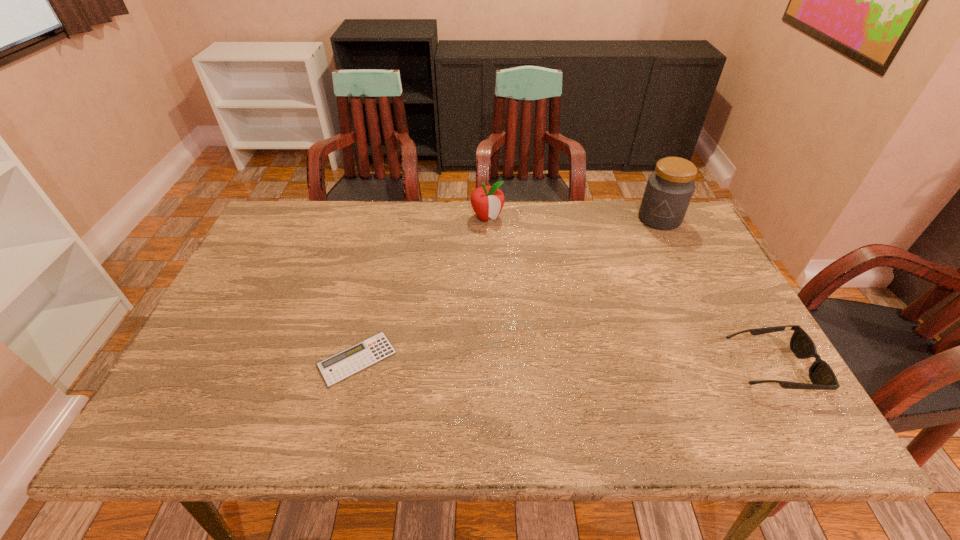
Find the location of `free space that satisfies the following two spatial constraints: 1. on the back side of the shortest object; 2. on the left side of the jar`. free space that satisfies the following two spatial constraints: 1. on the back side of the shortest object; 2. on the left side of the jar is located at coordinates (391, 219).